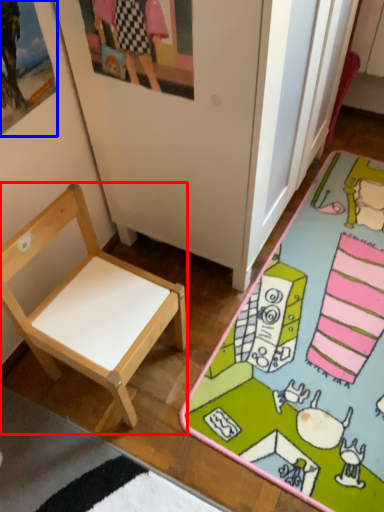
Question: Which object appears closest to the camera in this image, chair (highlighted by a red box) or picture frame (highlighted by a blue box)?

Choices:
 (A) chair
 (B) picture frame

Answer: (B)